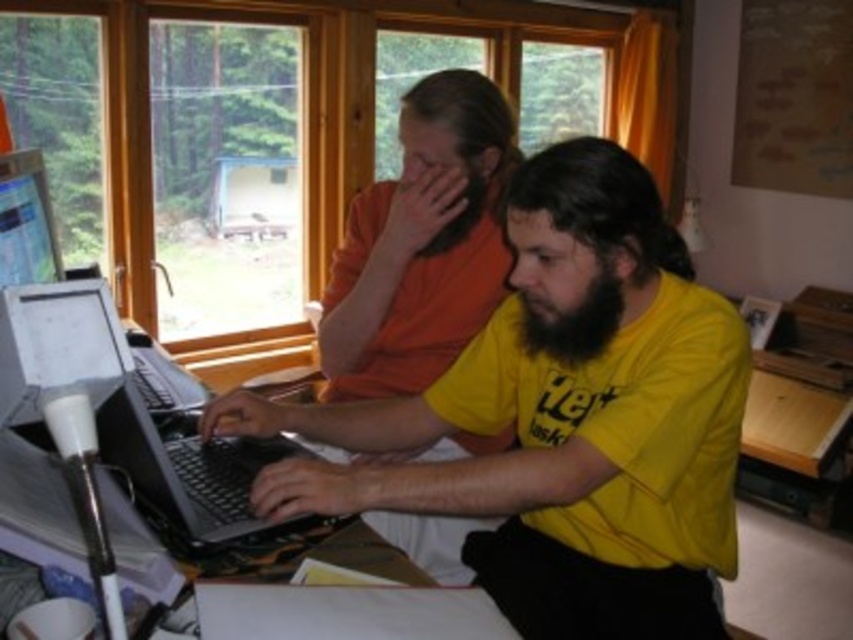
You are a delivery robot with a package that measures 15 inches in length. You need to place the package between the yellow matte shirt at center and the black plastic laptop at left. Is there enough space to fit the package between them?

The distance between the yellow matte shirt at center and the black plastic laptop at left is 14.82 inches. Since the package is 15 inches long, it is slightly too long to fit in the available space.

Looking at this image, you are a photographer standing in front of the desk. You want to take a photo of both the yellow matte shirt at center and the orange matte shirt at center. Which person should you focus on first to ensure both are in focus?

You should focus on the yellow matte shirt at center first because it is closer to the viewer than the orange matte shirt at center, so adjusting focus from near to far will help both be in focus.

You are standing in front of the desk in the home office. There are two points marked on the desk surface. One is at coordinate point [701,572] and the other at point [99,332]. Which point is closer to you?

Point [701,572] is further to the viewer than point [99,332], so the point closer to you is point [99,332].